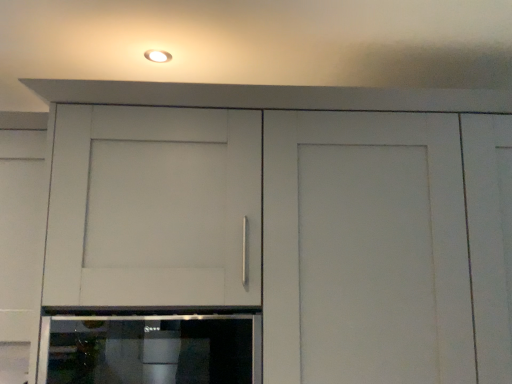
Question: Is matte white light fixture at upper center with sleek stainless steel oven at lower center?

Choices:
 (A) no
 (B) yes

Answer: (A)

Question: From a real-world perspective, is matte white light fixture at upper center on sleek stainless steel oven at lower center?

Choices:
 (A) no
 (B) yes

Answer: (B)

Question: From the image's perspective, is matte white light fixture at upper center beneath sleek stainless steel oven at lower center?

Choices:
 (A) yes
 (B) no

Answer: (B)

Question: Could you tell me if matte white light fixture at upper center is facing sleek stainless steel oven at lower center?

Choices:
 (A) yes
 (B) no

Answer: (B)

Question: Is matte white light fixture at upper center wider than sleek stainless steel oven at lower center?

Choices:
 (A) yes
 (B) no

Answer: (B)

Question: Would you say matte white light fixture at upper center is outside sleek stainless steel oven at lower center?

Choices:
 (A) no
 (B) yes

Answer: (B)

Question: Is sleek stainless steel oven at lower center facing away from matte white light fixture at upper center?

Choices:
 (A) yes
 (B) no

Answer: (B)

Question: From a real-world perspective, is sleek stainless steel oven at lower center located higher than matte white light fixture at upper center?

Choices:
 (A) no
 (B) yes

Answer: (A)

Question: From the image's perspective, is sleek stainless steel oven at lower center beneath matte white light fixture at upper center?

Choices:
 (A) no
 (B) yes

Answer: (B)

Question: Can you confirm if sleek stainless steel oven at lower center is taller than matte white light fixture at upper center?

Choices:
 (A) no
 (B) yes

Answer: (B)

Question: Does sleek stainless steel oven at lower center have a smaller size compared to matte white light fixture at upper center?

Choices:
 (A) no
 (B) yes

Answer: (A)

Question: Is sleek stainless steel oven at lower center at the right side of matte white light fixture at upper center?

Choices:
 (A) yes
 (B) no

Answer: (A)

Question: Is sleek stainless steel oven at lower center taller or shorter than matte white light fixture at upper center?

Choices:
 (A) short
 (B) tall

Answer: (B)